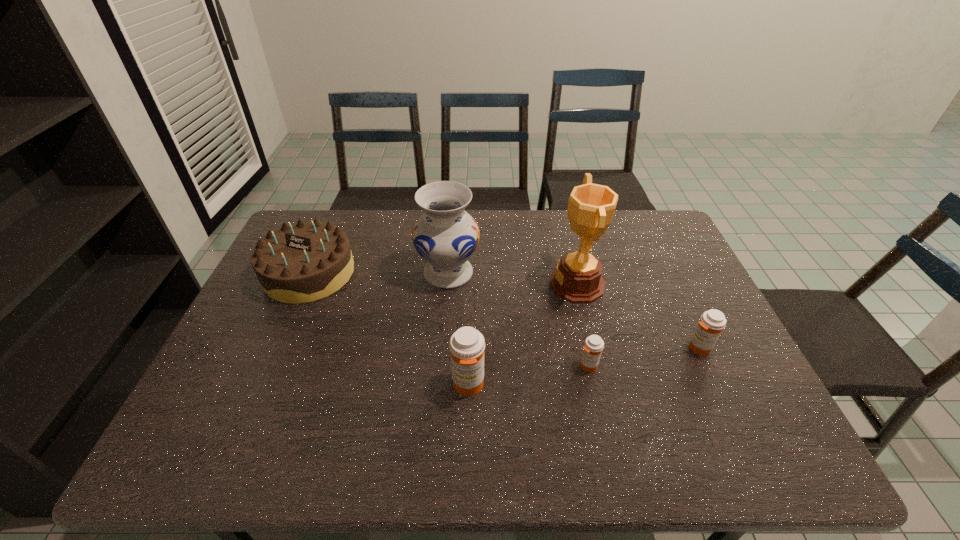
Locate an element on the screen. The width and height of the screenshot is (960, 540). empty space between the award and the fifth shortest object is located at coordinates (513, 279).

Where is `free space between the award and the shortest object`? This screenshot has height=540, width=960. free space between the award and the shortest object is located at coordinates (583, 325).

Where is `unoccupied area between the award and the vase`? This screenshot has width=960, height=540. unoccupied area between the award and the vase is located at coordinates (513, 279).

Locate an element on the screen. The image size is (960, 540). vacant space that is in between the award and the second medicine from left to right is located at coordinates (583, 325).

Locate an element on the screen. The height and width of the screenshot is (540, 960). empty space between the tallest medicine and the award is located at coordinates pos(522,335).

Identify the location of vacant point located between the shortest medicine and the rightmost medicine. The image size is (960, 540). (643, 357).

Where is `object that is the fifth closest to the vase`? Image resolution: width=960 pixels, height=540 pixels. object that is the fifth closest to the vase is located at coordinates (712, 322).

The image size is (960, 540). I want to click on object that can be found as the closest to the second tallest object, so click(x=300, y=263).

At what (x,y) coordinates should I click in order to perform the action: click on medicine that stands as the second closest to the fourth farthest object. Please return your answer as a coordinate pair (x, y). The width and height of the screenshot is (960, 540). Looking at the image, I should click on (467, 345).

What are the coordinates of `medicine that stands as the second closest to the fifth shortest object` in the screenshot? It's located at (593, 346).